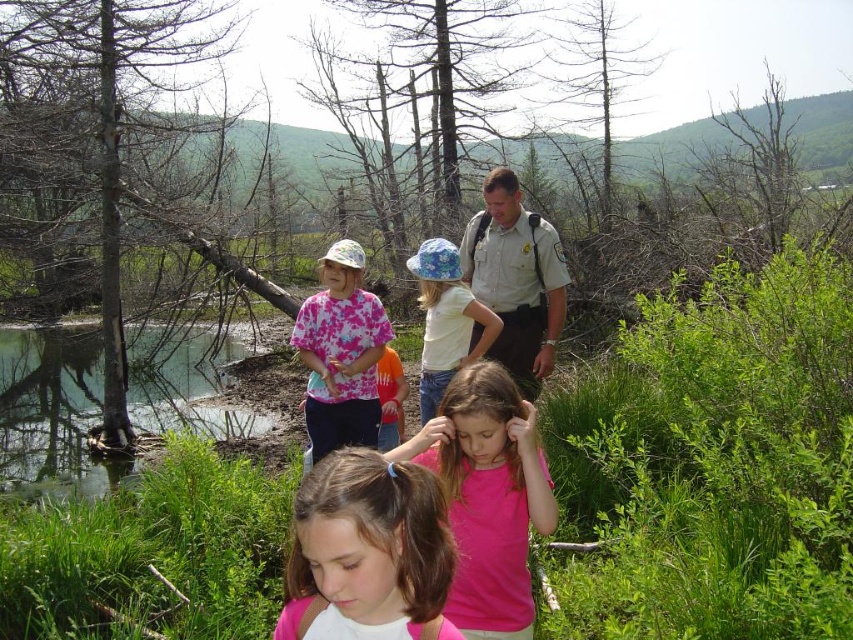
Looking at this image, you are a photographer trying to capture a shot of the khaki uniform at center and the floral fabric hat at center. Since both are at the center, how can you determine their positions relative to each other?

→ The khaki uniform at center is positioned to the right of the floral fabric hat at center, so you can frame the shot with the khaki uniform at center on the right side and the floral fabric hat at center on the left side.

What is located at the coordinates point (x=515, y=280) in the image?

The point (x=515, y=280) indicates the khaki uniform at center.

You are a photographer trying to capture a clear shot of the khaki uniform at center and the floral fabric hat at center. Which object is blocking the view of the other?

The floral fabric hat at center is behind the khaki uniform at center, so the khaki uniform is blocking the view of the floral fabric hat.